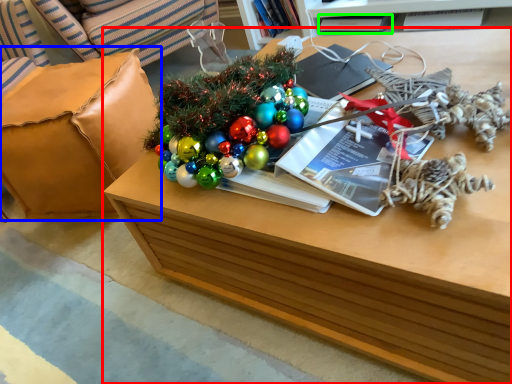
Question: Which is nearer to the table (highlighted by a red box)? armchair (highlighted by a blue box) or book (highlighted by a green box).

Choices:
 (A) armchair
 (B) book

Answer: (A)